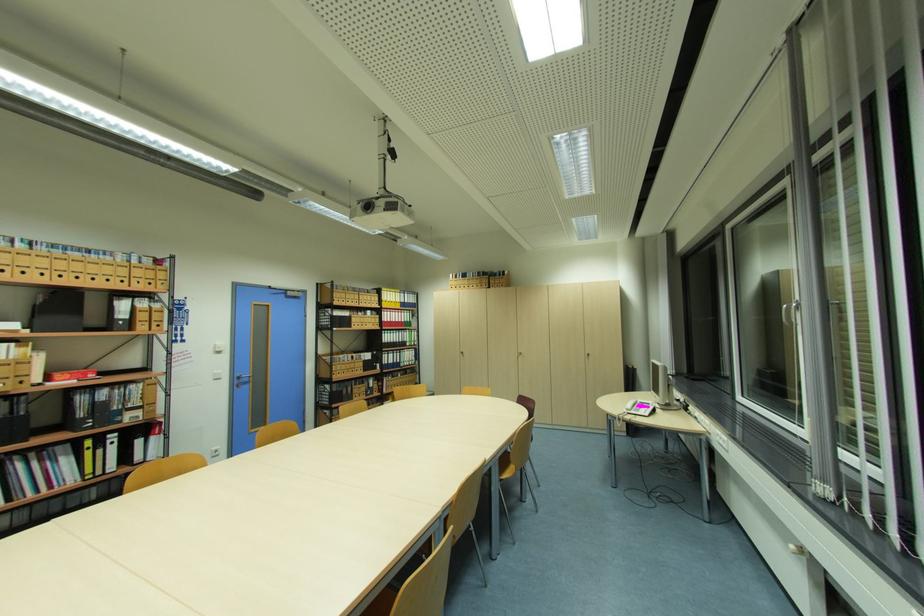
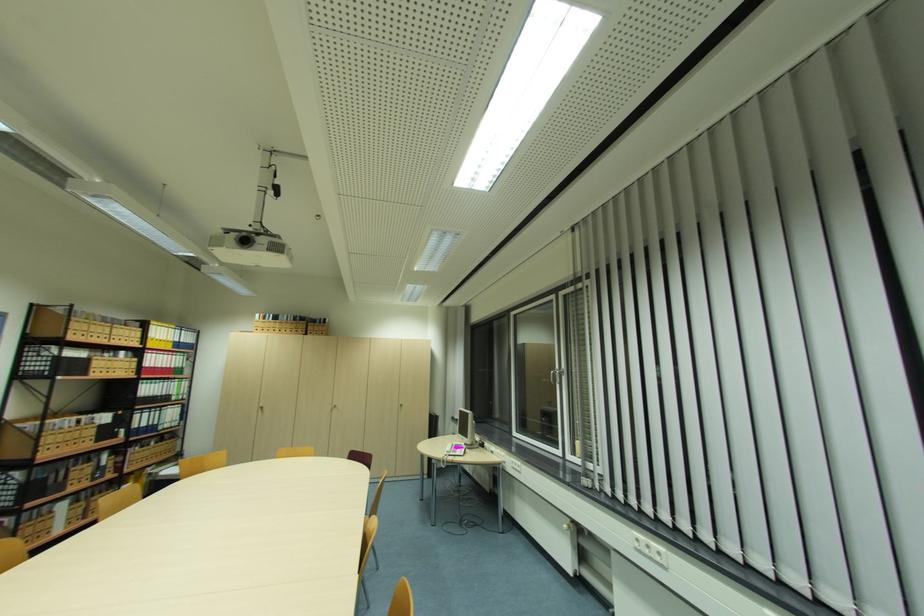
Question: Based on the continuous images, in which direction is the camera rotating? Reply with the corresponding letter.

Choices:
 (A) Left
 (B) Right
 (C) Up
 (D) Down

Answer: (B)